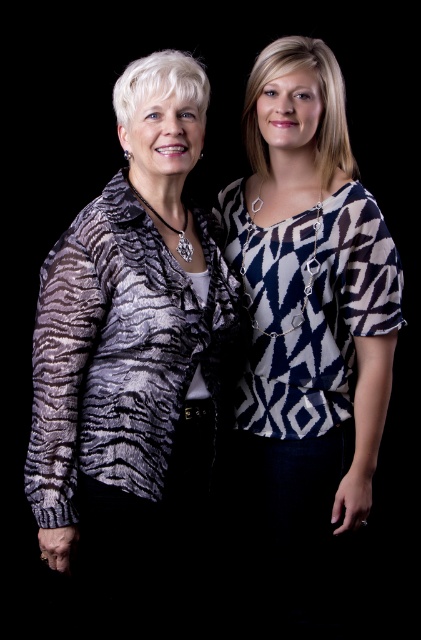
Looking at this image, who is more distant from viewer, (58,266) or (316,209)?

The point (316,209) is behind.

Does zebra print jacket at left appear on the right side of textured black and white sweater at left?

No, zebra print jacket at left is not to the right of textured black and white sweater at left.

Is point (159, 483) positioned behind point (271, 404)?

No, it is not.

Locate an element on the screen. The height and width of the screenshot is (640, 421). zebra print jacket at left is located at coordinates (135, 365).